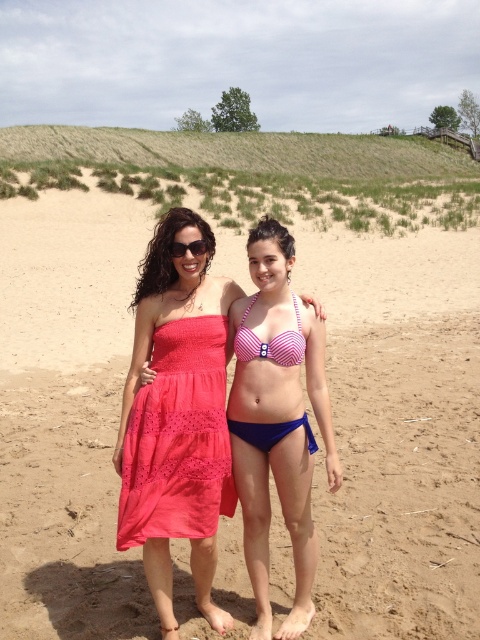
Does beige sandy beach at center appear on the left side of matte coral dress at center?

No, beige sandy beach at center is not to the left of matte coral dress at center.

Does point (367, 298) lie in front of point (158, 396)?

No, it is not.

What are the coordinates of `beige sandy beach at center` in the screenshot? It's located at (397, 432).

Which of these two, pink striped bikini at center or black plastic sunglasses at upper center, stands taller?

With more height is pink striped bikini at center.

Does point (196, 237) come in front of point (177, 243)?

No, it is behind (177, 243).

Locate an element on the screen. pink striped bikini at center is located at coordinates (177, 417).

What do you see at coordinates (179, 438) in the screenshot? I see `matte coral dress at center` at bounding box center [179, 438].

Which of these two, matte coral dress at center or black plastic sunglasses at upper center, stands shorter?

With less height is black plastic sunglasses at upper center.

Is point (206, 436) more distant than point (168, 250)?

No, (206, 436) is closer to viewer.

At what (x,y) coordinates should I click in order to perform the action: click on matte coral dress at center. Please return your answer as a coordinate pair (x, y). The width and height of the screenshot is (480, 640). Looking at the image, I should click on (179, 438).